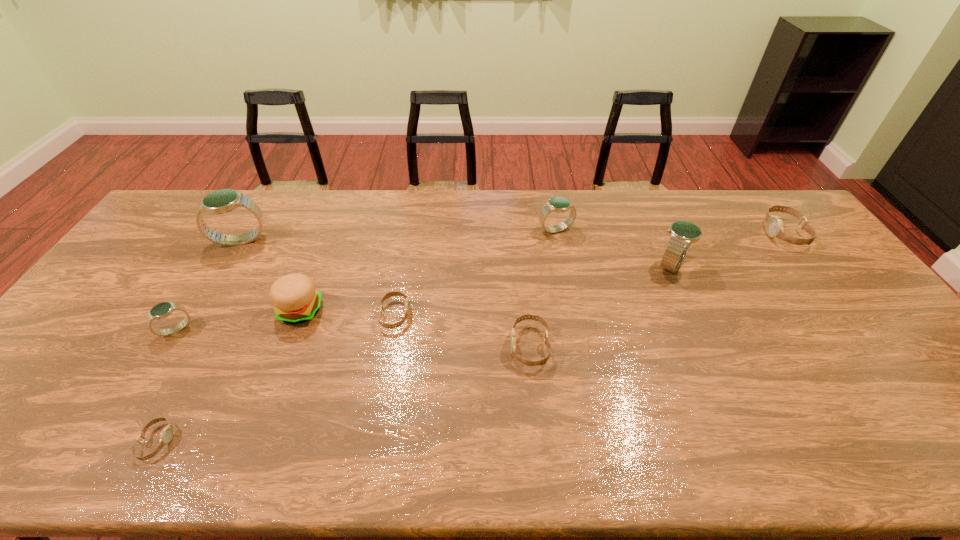
Locate an element on the screen. the biggest blue watch is located at coordinates (222, 201).

Image resolution: width=960 pixels, height=540 pixels. I want to click on the tallest object, so click(x=222, y=201).

Locate an element on the screen. Image resolution: width=960 pixels, height=540 pixels. the rightmost blue watch is located at coordinates (682, 233).

This screenshot has width=960, height=540. I want to click on the seventh watch from left to right, so [x=682, y=233].

The width and height of the screenshot is (960, 540). Find the location of `the sixth shortest watch`. the sixth shortest watch is located at coordinates (556, 204).

You are a GUI agent. You are given a task and a screenshot of the screen. Output one action in this format:
    pyautogui.click(x=<x>, y=<y>)
    Task: Click on the second smallest blue watch
    The height and width of the screenshot is (540, 960).
    Given the screenshot: What is the action you would take?
    pyautogui.click(x=556, y=204)

This screenshot has height=540, width=960. In order to click on beige hamburger in this screenshot , I will do `click(295, 300)`.

Locate an element on the screen. This screenshot has height=540, width=960. the fourth object from left to right is located at coordinates (295, 300).

The height and width of the screenshot is (540, 960). I want to click on the smallest blue watch, so click(x=162, y=310).

Find the location of `the rightmost beige watch`. the rightmost beige watch is located at coordinates click(774, 225).